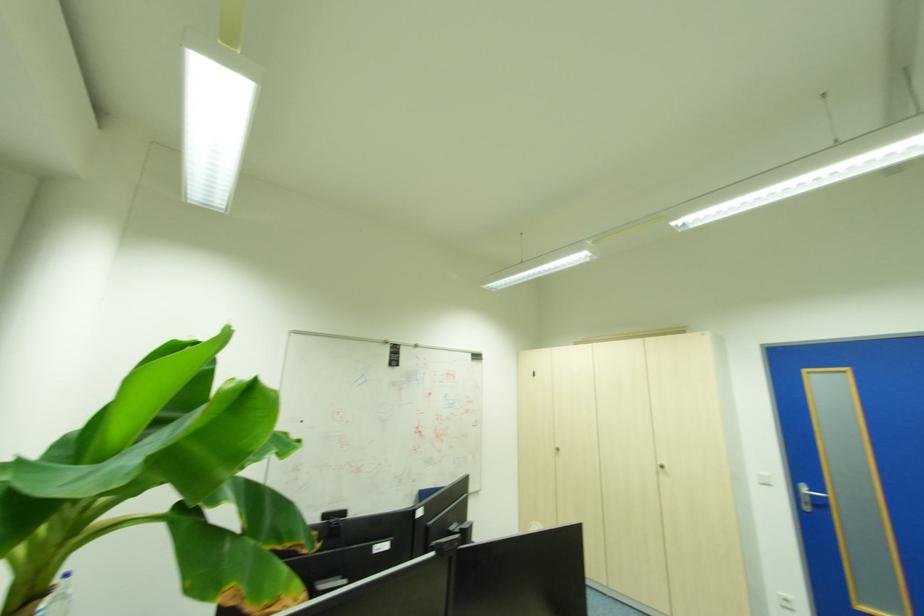
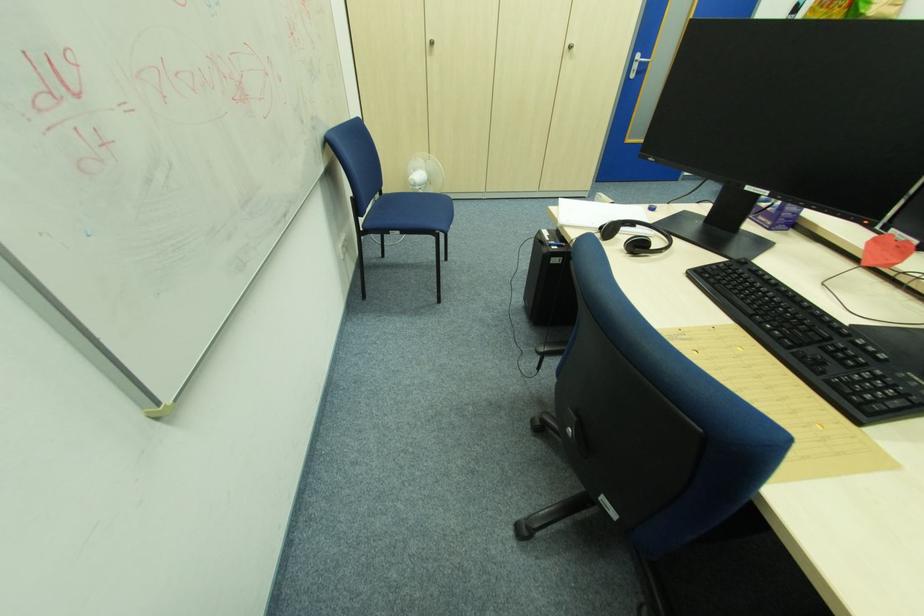
Find the pixel in the second image that matches point 815,492 in the first image.

(647, 61)